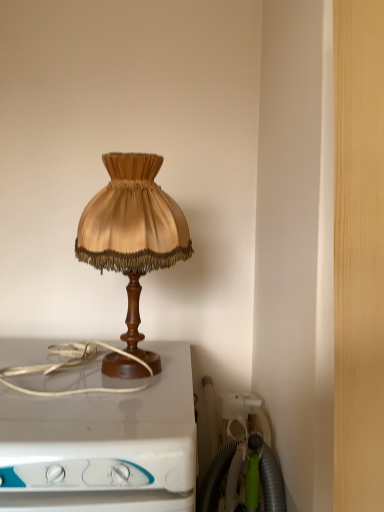
What do you see at coordinates (133, 233) in the screenshot? I see `satin gold lampshade at center` at bounding box center [133, 233].

Image resolution: width=384 pixels, height=512 pixels. I want to click on satin gold lampshade at center, so click(133, 233).

Where is `satin gold lampshade at center`? Image resolution: width=384 pixels, height=512 pixels. satin gold lampshade at center is located at coordinates (133, 233).